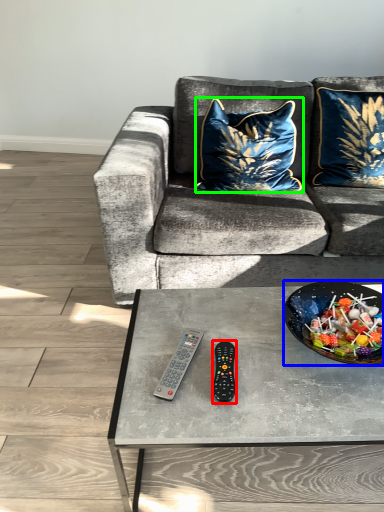
Question: Which object is the closest to the remote (highlighted by a red box)? Choose among these: bowl (highlighted by a blue box) or pillow (highlighted by a green box).

Choices:
 (A) bowl
 (B) pillow

Answer: (A)